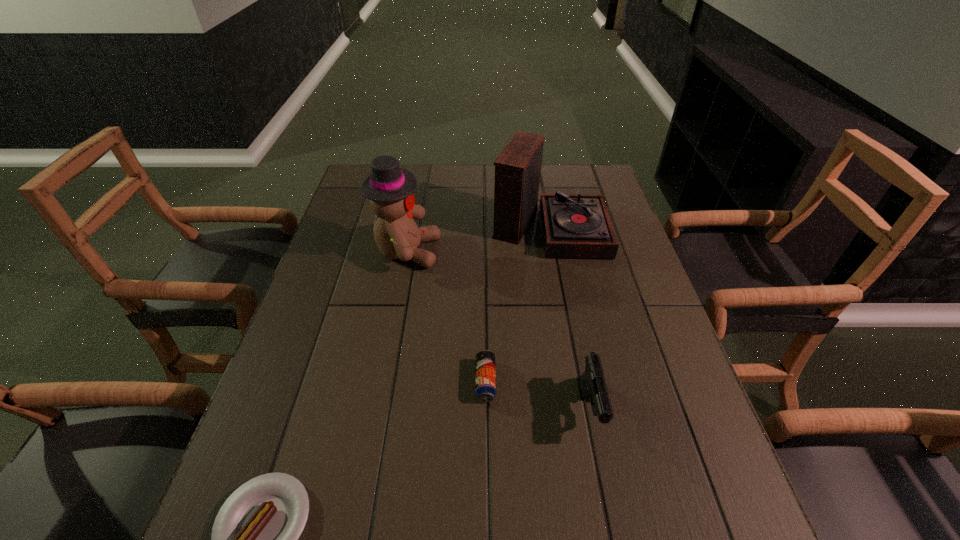
You are a GUI agent. You are given a task and a screenshot of the screen. Output one action in this format:
    pyautogui.click(x=<x>, y=<y>)
    Task: Click on the free space between the third shortest object and the phonograph record
    
    Given the screenshot: What is the action you would take?
    pyautogui.click(x=570, y=316)

This screenshot has height=540, width=960. Find the location of `empty location between the third object from left to right and the phonograph record`. empty location between the third object from left to right and the phonograph record is located at coordinates (517, 303).

Choose which object is the third nearest neighbor to the rag_doll. Please provide its 2D coordinates. Your answer should be formatted as a tuple, i.e. [(x, y)], where the tuple contains the x and y coordinates of a point satisfying the conditions above.

[(592, 382)]

You are a GUI agent. You are given a task and a screenshot of the screen. Output one action in this format:
    pyautogui.click(x=<x>, y=<y>)
    Task: Click on the object that is the closest to the rag_doll
    The height and width of the screenshot is (540, 960).
    Given the screenshot: What is the action you would take?
    pyautogui.click(x=574, y=225)

Locate an element on the screen. This screenshot has height=540, width=960. free region that satisfies the following two spatial constraints: 1. on the front side of the phonograph record; 2. on the front-facing side of the rag_doll is located at coordinates [x=555, y=252].

The image size is (960, 540). I want to click on free location that satisfies the following two spatial constraints: 1. on the front-facing side of the beer can; 2. on the left side of the rag_doll, so click(382, 381).

I want to click on vacant area that satisfies the following two spatial constraints: 1. on the front-facing side of the rag_doll; 2. on the left side of the third object from right to left, so click(x=382, y=381).